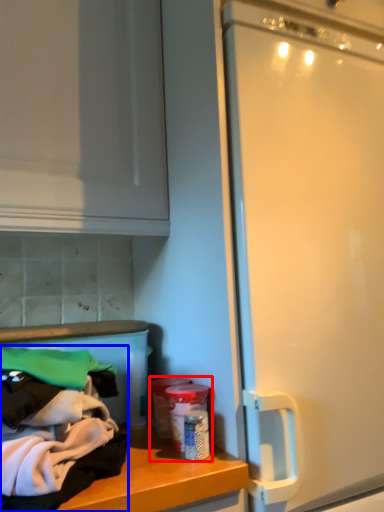
Question: Which of the following is the closest to the observer, garbage (highlighted by a red box) or clothing (highlighted by a blue box)?

Choices:
 (A) garbage
 (B) clothing

Answer: (B)